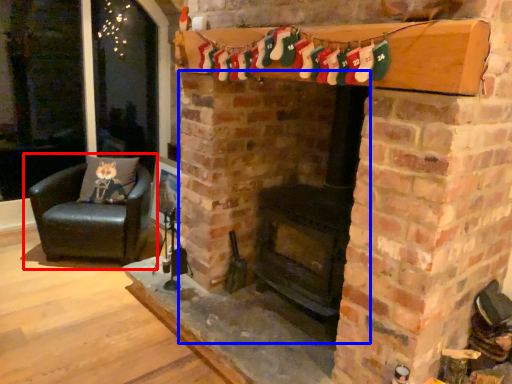
Question: Among these objects, which one is nearest to the camera, chair (highlighted by a red box) or fireplace (highlighted by a blue box)?

Choices:
 (A) chair
 (B) fireplace

Answer: (B)